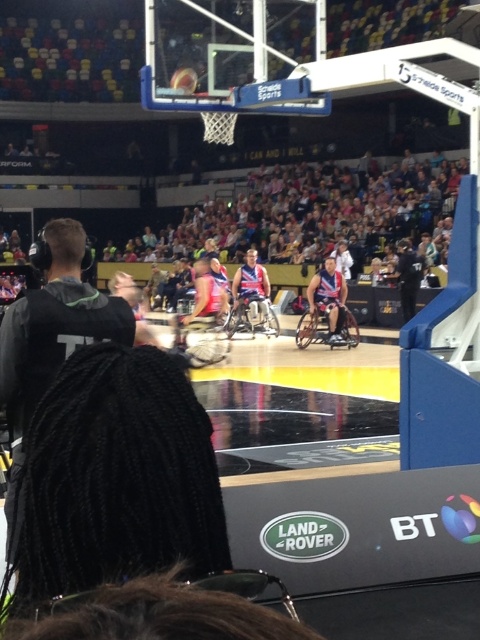
Question: Which point is closer to the camera?

Choices:
 (A) (45, 301)
 (B) (182, 70)

Answer: (A)

Question: Does black hoodie at left appear on the right side of shiny metallic basketball at center?

Choices:
 (A) no
 (B) yes

Answer: (A)

Question: Which point is closer to the camera taking this photo?

Choices:
 (A) (38, 387)
 (B) (195, 86)

Answer: (A)

Question: Can you confirm if black hoodie at left is smaller than shiny metallic basketball at center?

Choices:
 (A) no
 (B) yes

Answer: (A)

Question: Which object is farther from the camera taking this photo?

Choices:
 (A) shiny metallic basketball at center
 (B) black hoodie at left

Answer: (A)

Question: Does black hoodie at left have a lesser width compared to shiny metallic basketball at center?

Choices:
 (A) no
 (B) yes

Answer: (A)